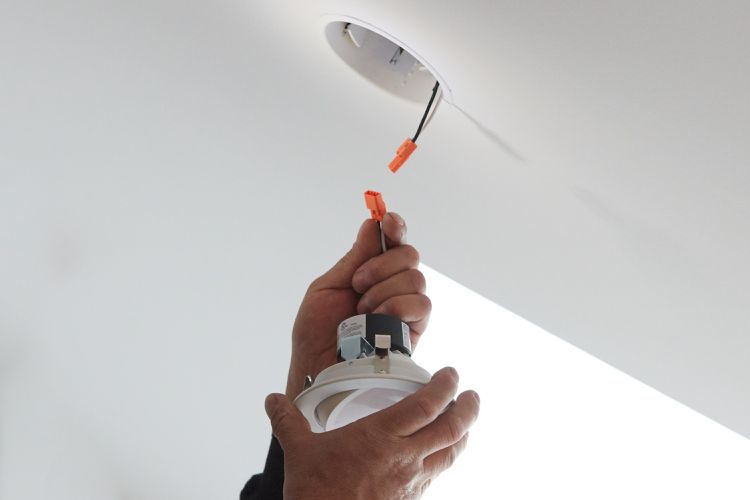
The width and height of the screenshot is (750, 500). In order to click on orange plug in this screenshot , I will do `click(376, 200)`.